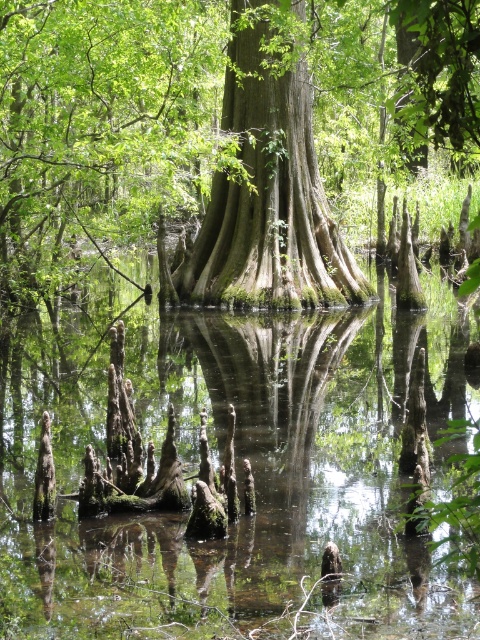
Question: Which point appears closest to the camera in this image?

Choices:
 (A) (265, 42)
 (B) (304, 445)
 (C) (225, 182)

Answer: (B)

Question: Considering the real-world distances, which object is farthest from the green mossy water at center?

Choices:
 (A) green mossy tree trunk at center
 (B) green rough bark tree at center

Answer: (B)

Question: Is green mossy water at center thinner than green mossy tree trunk at center?

Choices:
 (A) no
 (B) yes

Answer: (A)

Question: Which of the following is the closest to the observer?

Choices:
 (A) (372, 536)
 (B) (357, 289)
 (C) (384, 237)

Answer: (A)

Question: In this image, where is green mossy water at center located relative to green mossy tree trunk at center?

Choices:
 (A) left
 (B) right

Answer: (B)

Question: Is green rough bark tree at center thinner than green mossy tree trunk at center?

Choices:
 (A) no
 (B) yes

Answer: (A)